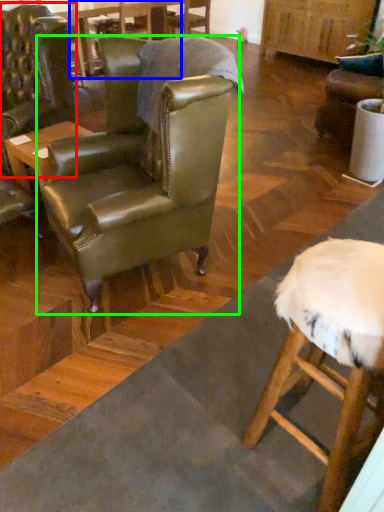
Question: Based on their relative distances, which object is farther from chair (highlighted by a red box)? Choose from table (highlighted by a blue box) and chair (highlighted by a green box).

Choices:
 (A) table
 (B) chair

Answer: (A)